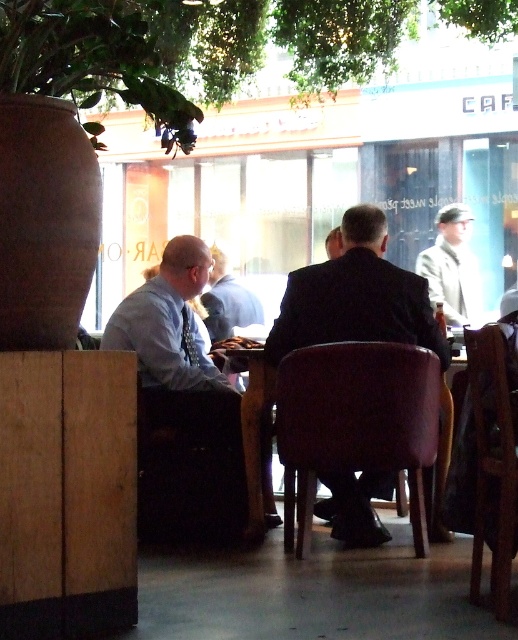
Question: Is light blue shirt at center behind smooth black suit at center?

Choices:
 (A) yes
 (B) no

Answer: (A)

Question: Is the position of velvet burgundy chair at center less distant than that of brown leather chair at lower right?

Choices:
 (A) yes
 (B) no

Answer: (B)

Question: Estimate the real-world distances between objects in this image. Which object is farther from the smooth black suit at center?

Choices:
 (A) light blue shirt at left
 (B) velvet burgundy chair at center

Answer: (B)

Question: Considering the real-world distances, which object is farthest from the light blue shirt at center?

Choices:
 (A) velvet burgundy chair at center
 (B) light blue shirt at left
 (C) smooth black suit at center
 (D) light beige suit at center

Answer: (A)

Question: Does light beige suit at center have a greater width compared to light blue shirt at center?

Choices:
 (A) no
 (B) yes

Answer: (B)

Question: Among these objects, which one is nearest to the camera?

Choices:
 (A) smooth black suit at center
 (B) brown leather chair at lower right
 (C) velvet burgundy chair at center

Answer: (B)